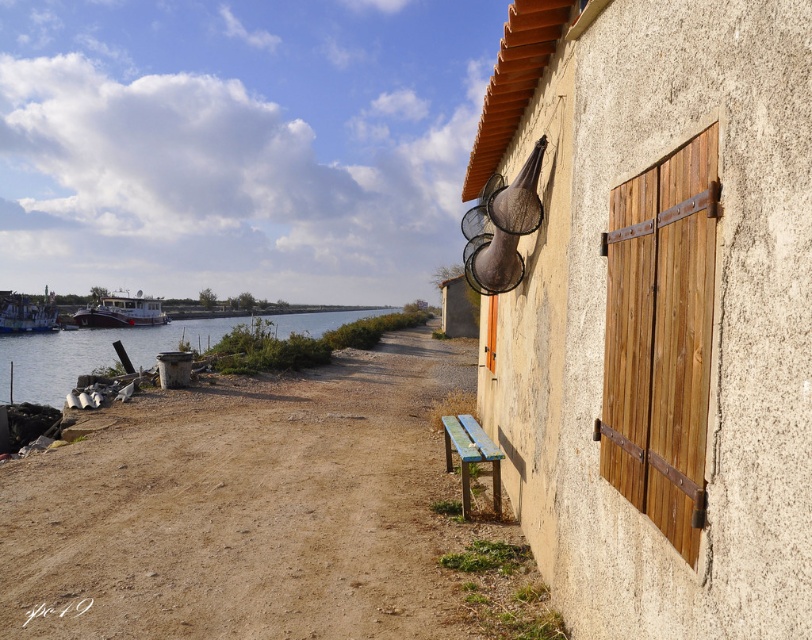
Who is higher up, brown dirt path at lower left or metallic silver boat at left?

metallic silver boat at left is above.

Is brown dirt path at lower left further to camera compared to metallic silver boat at left?

No, brown dirt path at lower left is closer to the viewer.

I want to click on brown dirt path at lower left, so click(264, 513).

The image size is (812, 640). Find the location of `brown dirt path at lower left`. brown dirt path at lower left is located at coordinates (264, 513).

Does brown dirt path at lower left have a smaller size compared to clear water at lower left?

Indeed, brown dirt path at lower left has a smaller size compared to clear water at lower left.

Which is in front, point (356, 531) or point (188, 339)?

Positioned in front is point (356, 531).

You are a GUI agent. You are given a task and a screenshot of the screen. Output one action in this format:
    pyautogui.click(x=<x>, y=<y>)
    Task: Click on the brown dirt path at lower left
    The width and height of the screenshot is (812, 640).
    Given the screenshot: What is the action you would take?
    pyautogui.click(x=264, y=513)

Consider the image. Does white glossy boat at left have a greater height compared to metallic silver boat at left?

Yes.

Can you confirm if white glossy boat at left is positioned to the left of metallic silver boat at left?

No, white glossy boat at left is not to the left of metallic silver boat at left.

Measure the distance between white glossy boat at left and camera.

67.43 meters

Where is `white glossy boat at left`? The image size is (812, 640). white glossy boat at left is located at coordinates (122, 310).